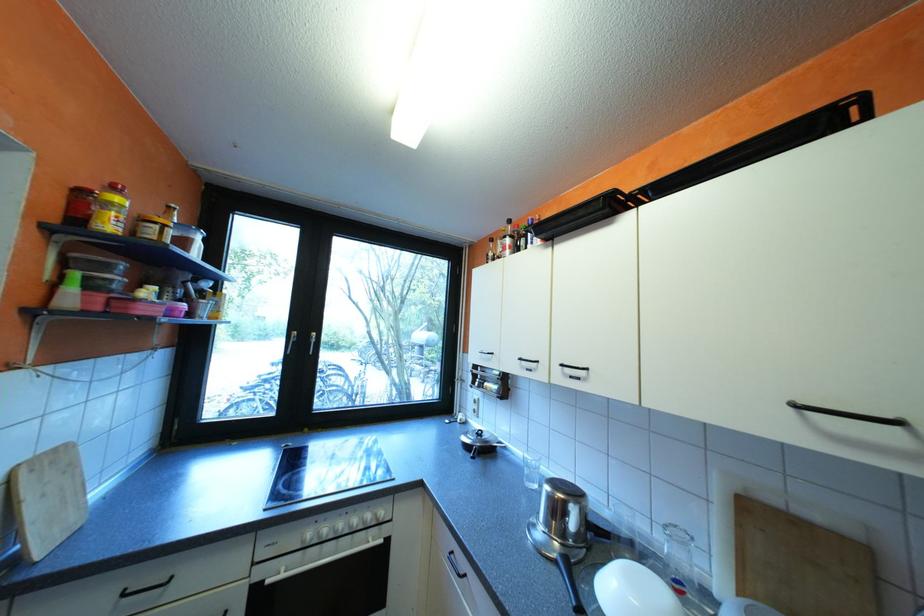
Find the location of `white oven handle`. white oven handle is located at coordinates (321, 546).